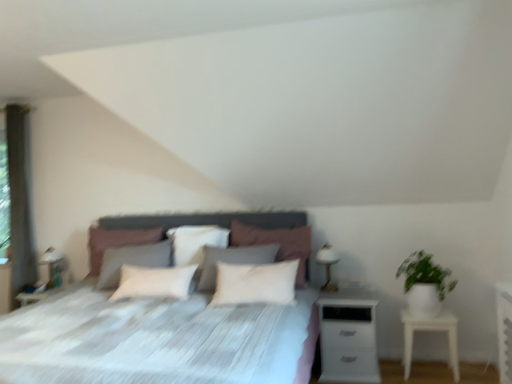
Question: Does white soft pillow at center, which ranks as the third pillow in left-to-right order, appear on the left side of white fabric bed at center?

Choices:
 (A) yes
 (B) no

Answer: (B)

Question: From a real-world perspective, is white soft pillow at center, which ranks as the third pillow in left-to-right order, located beneath white fabric bed at center?

Choices:
 (A) no
 (B) yes

Answer: (A)

Question: Considering the relative sizes of white soft pillow at center, which ranks as the third pillow in left-to-right order, and white fabric bed at center in the image provided, is white soft pillow at center, which ranks as the third pillow in left-to-right order, wider than white fabric bed at center?

Choices:
 (A) yes
 (B) no

Answer: (B)

Question: Are white soft pillow at center, marked as the first pillow in a right-to-left arrangement, and white fabric bed at center beside each other?

Choices:
 (A) no
 (B) yes

Answer: (A)

Question: From the image's perspective, does white soft pillow at center, marked as the first pillow in a right-to-left arrangement, appear lower than white fabric bed at center?

Choices:
 (A) yes
 (B) no

Answer: (B)

Question: In terms of width, does green matte plant at right look wider or thinner when compared to white soft pillow at center, which appears as the 2th pillow when viewed from the right?

Choices:
 (A) wide
 (B) thin

Answer: (A)

Question: Is point (423, 258) positioned closer to the camera than point (181, 236)?

Choices:
 (A) farther
 (B) closer

Answer: (B)

Question: From a real-world perspective, relative to white soft pillow at center, which appears as the 2th pillow when viewed from the right, is green matte plant at right vertically above or below?

Choices:
 (A) above
 (B) below

Answer: (B)

Question: Relative to white soft pillow at center, which appears as the 2th pillow when viewed from the right, is green matte plant at right in front or behind?

Choices:
 (A) front
 (B) behind

Answer: (A)

Question: Is white soft pillow at center, acting as the 3th pillow starting from the right, taller or shorter than green matte plant at right?

Choices:
 (A) short
 (B) tall

Answer: (B)

Question: From the image's perspective, is white soft pillow at center, the first pillow in the left-to-right sequence, located above or below green matte plant at right?

Choices:
 (A) above
 (B) below

Answer: (A)

Question: Is point pos(142,231) closer or farther from the camera than point pos(402,271)?

Choices:
 (A) closer
 (B) farther

Answer: (B)

Question: From a real-world perspective, is white soft pillow at center, the first pillow in the left-to-right sequence, above or below green matte plant at right?

Choices:
 (A) below
 (B) above

Answer: (B)

Question: Considering the positions of gray fabric curtain at left and green matte plant at right in the image, is gray fabric curtain at left bigger or smaller than green matte plant at right?

Choices:
 (A) small
 (B) big

Answer: (B)

Question: Would you say gray fabric curtain at left is inside or outside green matte plant at right?

Choices:
 (A) outside
 (B) inside

Answer: (A)